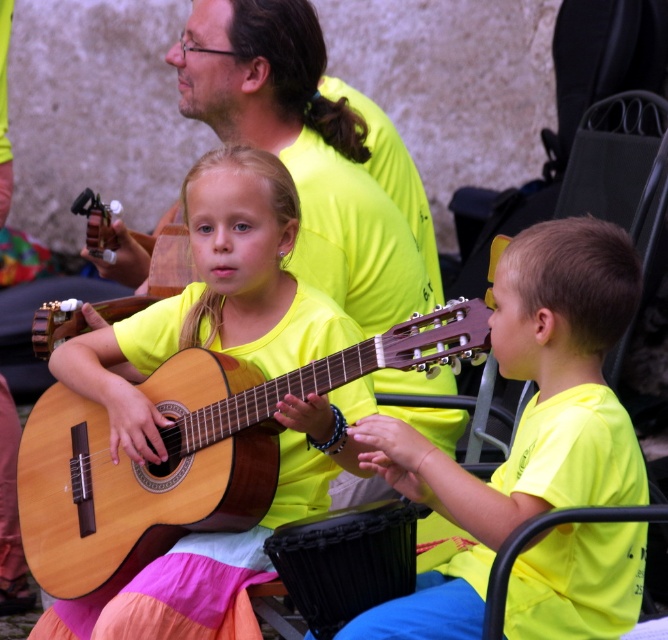
You are a photographer setting up for a group photo. You need to position the yellow matte guitar at right and the natural wood guitar at center so that they are aligned horizontally. Which guitar should you move to the left to achieve this alignment?

The yellow matte guitar at right is currently to the right of the natural wood guitar at center. To align them horizontally, move the yellow matte guitar at right to the left until it is next to the natural wood guitar at center.

You are standing in front of the image and want to touch the two points labeled as point (580, 276) and point (158, 483). Which point would require you to reach further forward to touch it?

Point (158, 483) would require reaching further forward because it is farther from the camera compared to point (580, 276).